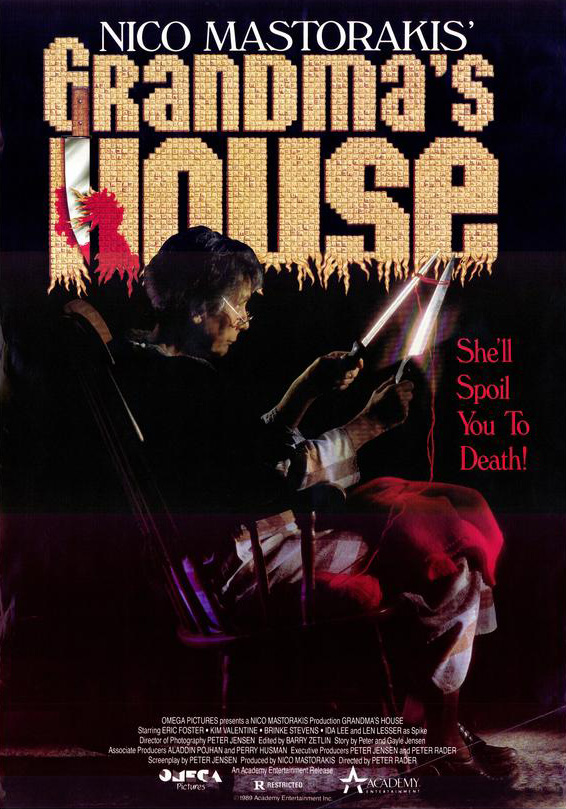
Where is `floor`? floor is located at coordinates (543, 769).